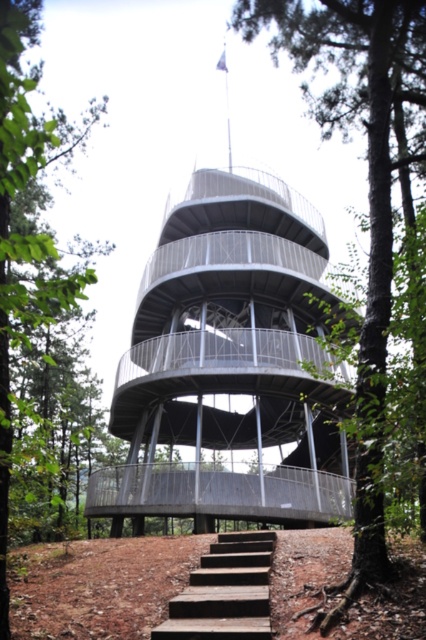
Consider the image. You are standing at the base of the metallic gray observation tower at center. If you walk straight ahead, will you encounter the wooden steps or the spiral staircase first?

The spiral staircase is part of the metallic gray observation tower at center, so walking straight ahead from the base would lead you to the spiral staircase first before reaching the wooden steps located at the base.

You are planning to build a new structure that needs to fit between the metallic gray observation tower at center and the green leafy tree at center. Based on their sizes, which one should you consider as the wider structure to ensure proper spacing?

The metallic gray observation tower at center is wider than the green leafy tree at center, so you should consider the metallic gray observation tower at center as the wider structure for proper spacing.